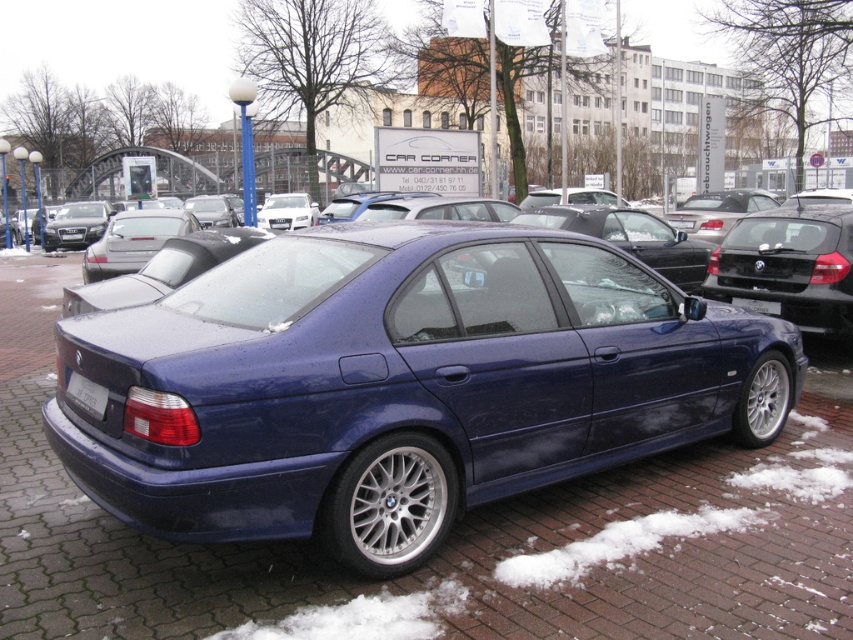
Question: Which point is farther to the camera?

Choices:
 (A) blue brick pavement at center
 (B) white plastic license plate at rear

Answer: (B)

Question: Does blue brick pavement at center appear under white plastic license plate at rear?

Choices:
 (A) yes
 (B) no

Answer: (A)

Question: Which of the following is the farthest from the observer?

Choices:
 (A) blue brick pavement at center
 (B) white plastic license plate at rear

Answer: (B)

Question: Which of the following is the farthest from the observer?

Choices:
 (A) (519, 577)
 (B) (100, 404)

Answer: (A)

Question: Is blue brick pavement at center to the left of white plastic license plate at rear from the viewer's perspective?

Choices:
 (A) no
 (B) yes

Answer: (A)

Question: Is blue brick pavement at center further to camera compared to white plastic license plate at rear?

Choices:
 (A) no
 (B) yes

Answer: (A)